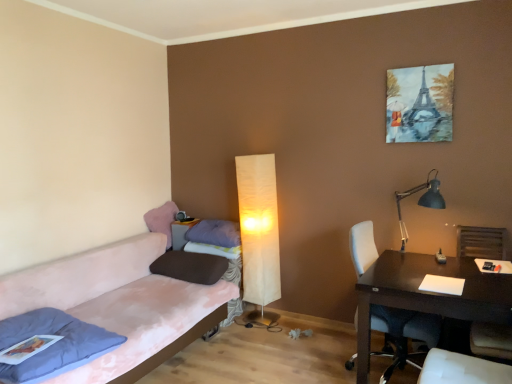
Question: Is pink fabric couch at left far away from brown matte pillow at center, which is the 3th pillow in back-to-front order?

Choices:
 (A) no
 (B) yes

Answer: (A)

Question: Can you confirm if pink fabric couch at left is positioned to the left of brown matte pillow at center, which is the 3th pillow in back-to-front order?

Choices:
 (A) yes
 (B) no

Answer: (A)

Question: From a real-world perspective, is pink fabric couch at left on brown matte pillow at center, which is the 3th pillow in back-to-front order?

Choices:
 (A) yes
 (B) no

Answer: (B)

Question: Is pink fabric couch at left oriented away from brown matte pillow at center, which is the 3th pillow in back-to-front order?

Choices:
 (A) no
 (B) yes

Answer: (A)

Question: Considering the relative sizes of pink fabric couch at left and brown matte pillow at center, which is the 3th pillow in back-to-front order, in the image provided, is pink fabric couch at left shorter than brown matte pillow at center, which is the 3th pillow in back-to-front order,?

Choices:
 (A) yes
 (B) no

Answer: (B)

Question: Would you say matte gray side table at lower left is to the left or to the right of brown matte pillow at center, which is counted as the second pillow, starting from the front, in the picture?

Choices:
 (A) left
 (B) right

Answer: (A)

Question: Based on their sizes in the image, would you say matte gray side table at lower left is bigger or smaller than brown matte pillow at center, which is counted as the second pillow, starting from the front?

Choices:
 (A) big
 (B) small

Answer: (B)

Question: Considering the positions of matte gray side table at lower left and brown matte pillow at center, which is counted as the second pillow, starting from the front, in the image, is matte gray side table at lower left taller or shorter than brown matte pillow at center, which is counted as the second pillow, starting from the front,?

Choices:
 (A) short
 (B) tall

Answer: (B)

Question: Considering the positions of point (180, 246) and point (172, 276), is point (180, 246) closer or farther from the camera than point (172, 276)?

Choices:
 (A) farther
 (B) closer

Answer: (A)

Question: In terms of height, does brown matte pillow at center, which is the 3th pillow in back-to-front order, look taller or shorter compared to purple soft pillow at center, which ranks as the 2th pillow in back-to-front order?

Choices:
 (A) tall
 (B) short

Answer: (B)

Question: Considering the positions of point (199, 273) and point (215, 231), is point (199, 273) closer or farther from the camera than point (215, 231)?

Choices:
 (A) farther
 (B) closer

Answer: (B)

Question: From the image's perspective, is brown matte pillow at center, which is counted as the second pillow, starting from the front, positioned above or below purple soft pillow at center, the 3th pillow viewed from the front?

Choices:
 (A) above
 (B) below

Answer: (B)

Question: From a real-world perspective, relative to purple soft pillow at center, the 3th pillow viewed from the front, is brown matte pillow at center, which is counted as the second pillow, starting from the front, vertically above or below?

Choices:
 (A) below
 (B) above

Answer: (A)

Question: From the image's perspective, is matte cream floor lamp at center, which ranks as the 1th lamp in back-to-front order, above or below matte gray side table at lower left?

Choices:
 (A) above
 (B) below

Answer: (A)

Question: Which is correct: matte cream floor lamp at center, the 2th lamp positioned from the front, is inside matte gray side table at lower left, or outside of it?

Choices:
 (A) outside
 (B) inside

Answer: (A)